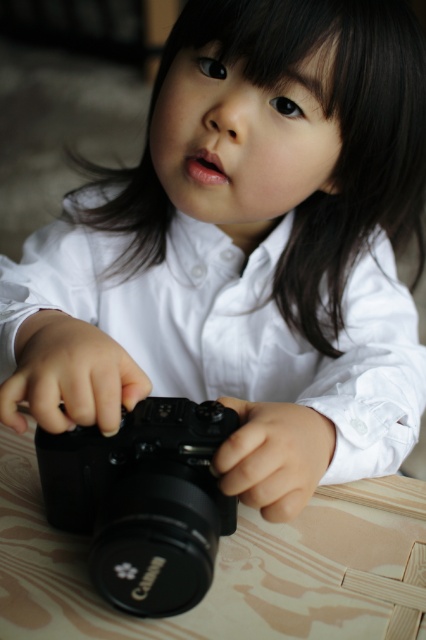
Question: Is wooden table at center smaller than black plastic camera at center?

Choices:
 (A) yes
 (B) no

Answer: (B)

Question: Which of the following is the farthest from the observer?

Choices:
 (A) (328, 625)
 (B) (155, 486)

Answer: (A)

Question: Which point is farther to the camera?

Choices:
 (A) wooden table at center
 (B) black plastic camera at center

Answer: (A)

Question: Which point is farther to the camera?

Choices:
 (A) (60, 588)
 (B) (187, 529)

Answer: (A)

Question: Is wooden table at center thinner than black plastic camera at center?

Choices:
 (A) yes
 (B) no

Answer: (B)

Question: Is wooden table at center in front of black plastic camera at center?

Choices:
 (A) yes
 (B) no

Answer: (B)